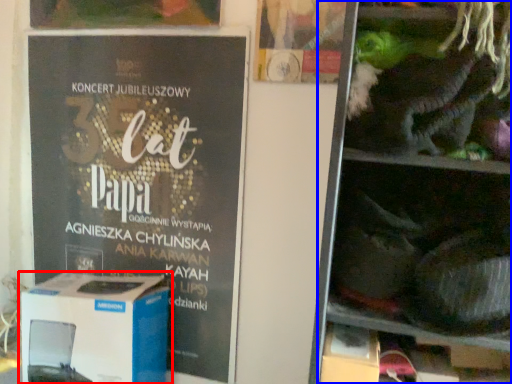
Question: Which point is closer to the camera, box (highlighted by a red box) or shelf (highlighted by a blue box)?

Choices:
 (A) box
 (B) shelf

Answer: (B)